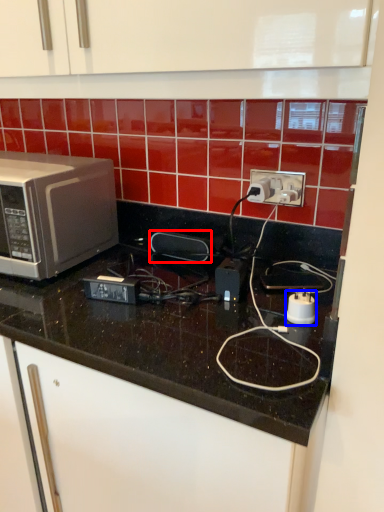
Question: Which point is further to the camera, appliance (highlighted by a red box) or appliance (highlighted by a blue box)?

Choices:
 (A) appliance
 (B) appliance

Answer: (A)